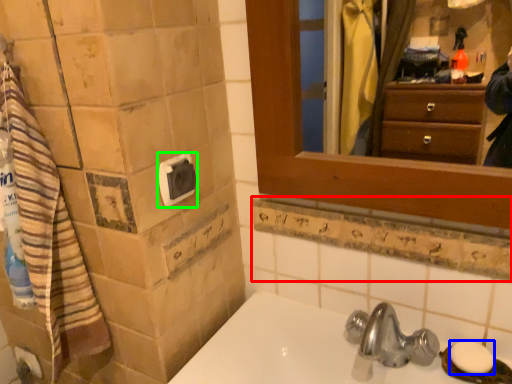
Question: Based on their relative distances, which object is farther from ledge (highlighted by a red box)? Choose from soap (highlighted by a blue box) and towel bar (highlighted by a green box).

Choices:
 (A) soap
 (B) towel bar

Answer: (B)